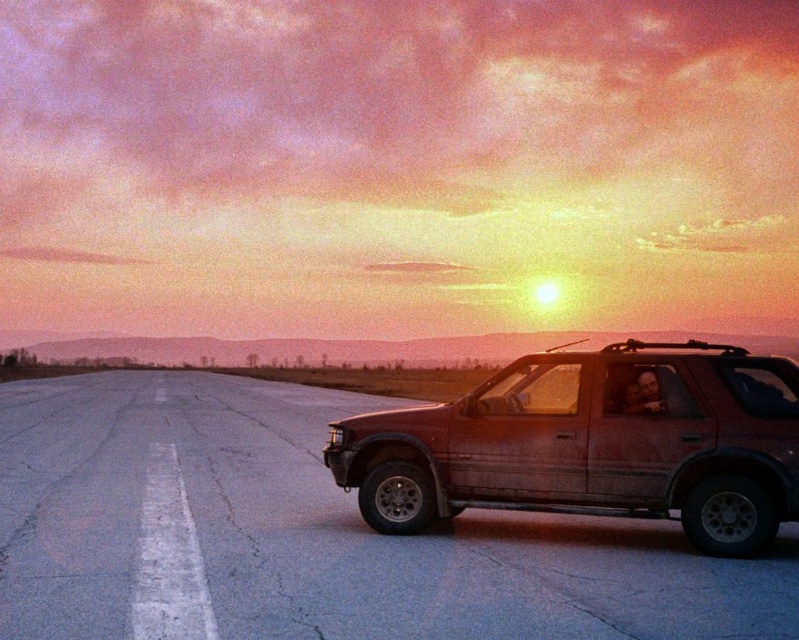
Who is higher up, smooth asphalt highway at center or matte red suv at right?

matte red suv at right is higher up.

Looking at this image, between smooth asphalt highway at center and matte red suv at right, which one appears on the right side from the viewer's perspective?

Positioned to the right is matte red suv at right.

Which is behind, point (134, 378) or point (400, 531)?

The point (134, 378) is behind.

Where is `smooth asphalt highway at center`? The image size is (799, 640). smooth asphalt highway at center is located at coordinates (311, 534).